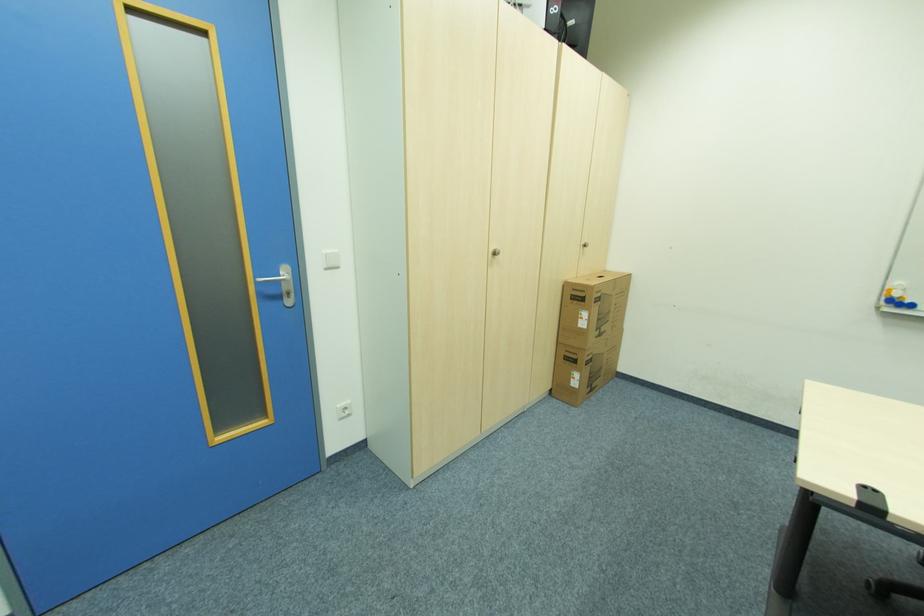
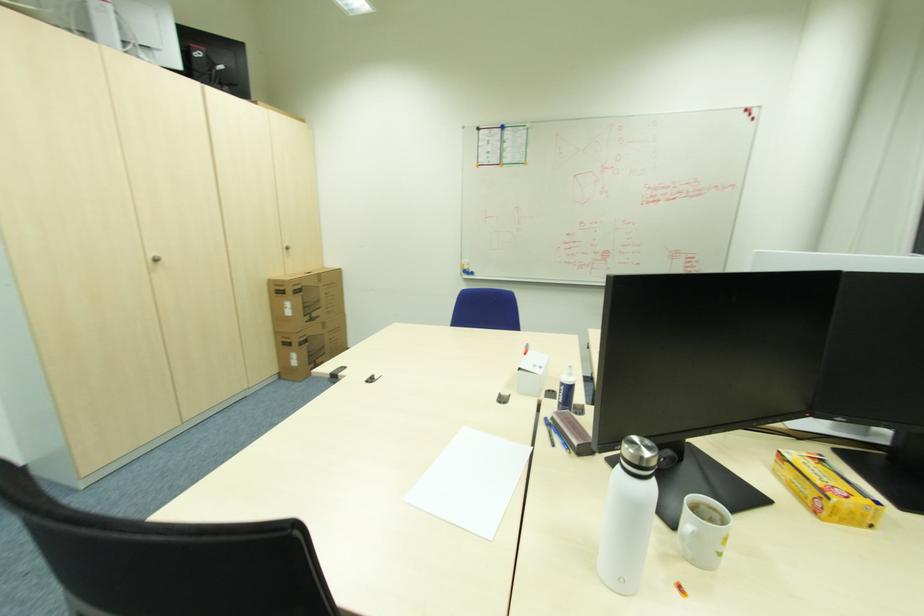
What movement of the cameraman would produce the second image?

The cameraman walked toward right, backward.